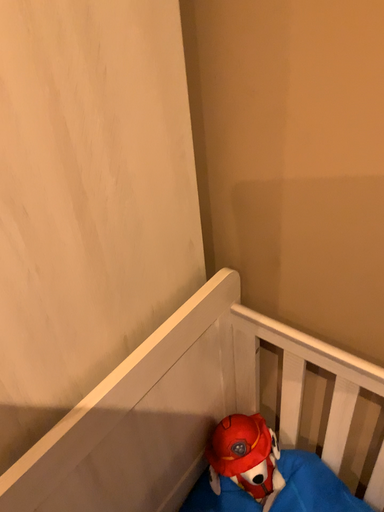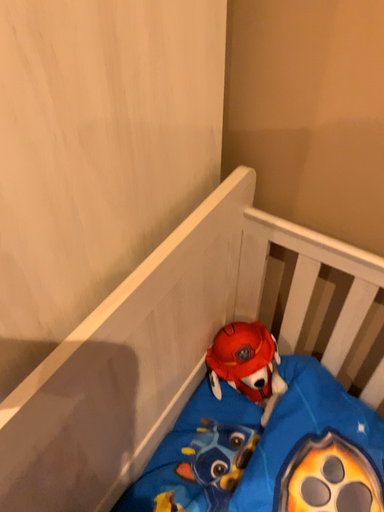
Question: Which way did the camera rotate in the video?

Choices:
 (A) rotated left
 (B) rotated right

Answer: (B)